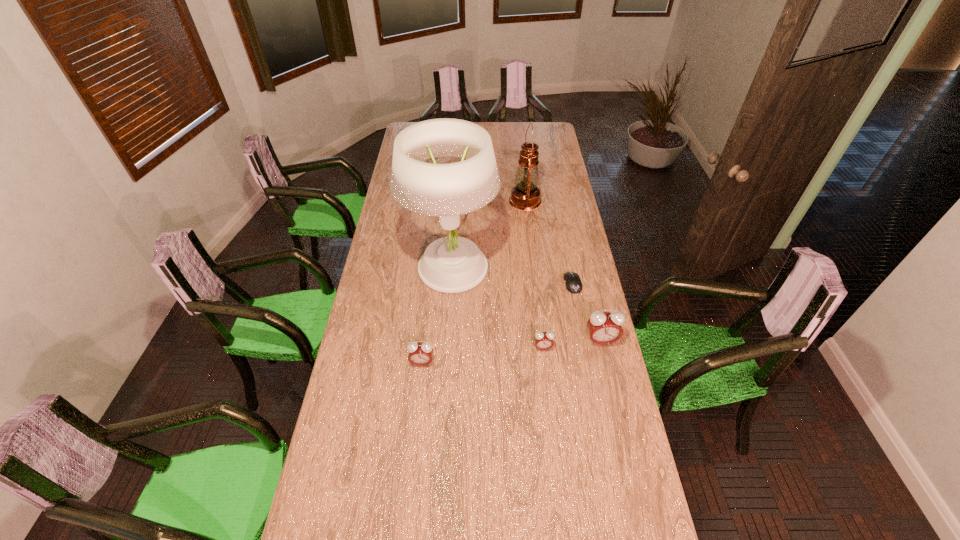
The height and width of the screenshot is (540, 960). In the image, there is a desktop. In order to click on free space at the far edge in this screenshot , I will do `click(525, 128)`.

Image resolution: width=960 pixels, height=540 pixels. In the image, there is a desktop. What are the coordinates of `vacant space at the left edge` in the screenshot? It's located at (395, 326).

Image resolution: width=960 pixels, height=540 pixels. Find the location of `free space at the right edge of the desktop`. free space at the right edge of the desktop is located at coordinates (596, 401).

Locate an element on the screen. Image resolution: width=960 pixels, height=540 pixels. blank region between the shortest alarm clock and the tallest object is located at coordinates (497, 309).

The height and width of the screenshot is (540, 960). Find the location of `free area in between the shortest alarm clock and the lamp`. free area in between the shortest alarm clock and the lamp is located at coordinates (497, 309).

This screenshot has height=540, width=960. I want to click on vacant region between the lamp and the second shortest alarm clock, so click(x=437, y=316).

What are the coordinates of `free spot between the nearest alarm clock and the tallest object` in the screenshot? It's located at (437, 316).

Where is `vacant space that is in between the second shortest alarm clock and the computer equipment`? This screenshot has width=960, height=540. vacant space that is in between the second shortest alarm clock and the computer equipment is located at coordinates (497, 323).

Where is `vacant area that lies between the third tallest object and the fourth tallest object`? The width and height of the screenshot is (960, 540). vacant area that lies between the third tallest object and the fourth tallest object is located at coordinates (512, 352).

The width and height of the screenshot is (960, 540). Find the location of `vacant space that is in between the tallest object and the nearest alarm clock`. vacant space that is in between the tallest object and the nearest alarm clock is located at coordinates (437, 316).